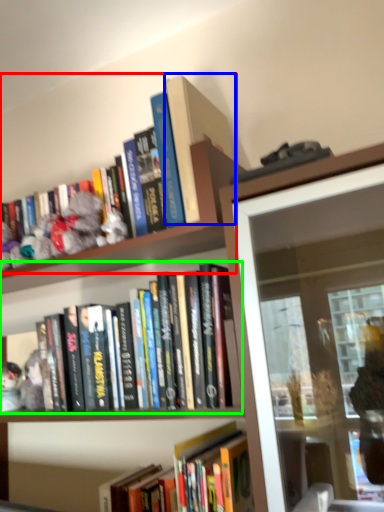
Question: Which object is positioned farthest from book (highlighted by a red box)? Select from book (highlighted by a blue box) and book (highlighted by a green box).

Choices:
 (A) book
 (B) book

Answer: (B)